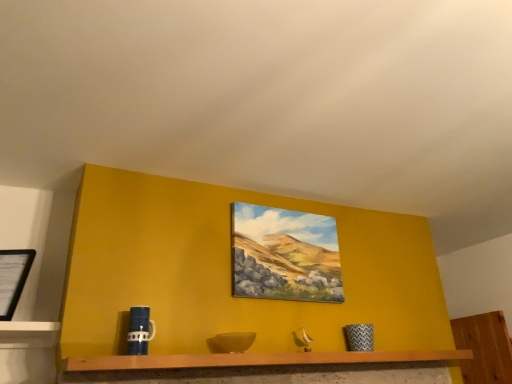
The height and width of the screenshot is (384, 512). What are the coordinates of `wooden shelf at center` in the screenshot? It's located at (257, 360).

The image size is (512, 384). In order to click on blue matte mug at lower left in this screenshot , I will do click(140, 330).

Considering the relative positions of blue matte mug at lower left and wooden shelf at center in the image provided, is blue matte mug at lower left to the right of wooden shelf at center from the viewer's perspective?

In fact, blue matte mug at lower left is to the left of wooden shelf at center.

How distant is blue matte mug at lower left from wooden shelf at center?

A distance of 16.38 inches exists between blue matte mug at lower left and wooden shelf at center.

In terms of width, does blue matte mug at lower left look wider or thinner when compared to wooden shelf at center?

In the image, blue matte mug at lower left appears to be more narrow than wooden shelf at center.

Consider the image. Is black matte picture frame at left, the second picture frame viewed from the back, surrounding blue matte mug at lower left?

No, blue matte mug at lower left is not inside black matte picture frame at left, the second picture frame viewed from the back.

Which object is closer to the camera, black matte picture frame at left, acting as the second picture frame starting from the right, or blue matte mug at lower left?

blue matte mug at lower left is closer to the camera.

Is black matte picture frame at left, the 1th picture frame viewed from the left, touching blue matte mug at lower left?

No, black matte picture frame at left, the 1th picture frame viewed from the left, is not making contact with blue matte mug at lower left.

Which object is positioned more to the right, black matte picture frame at left, the 1th picture frame viewed from the left, or blue matte mug at lower left?

Positioned to the right is blue matte mug at lower left.

Looking at this image, is the position of wooden shelf at center less distant than that of matte canvas painting at center, which ranks as the 1th picture frame in right-to-left order?

Yes, it is.

Which point is more forward, (141, 358) or (324, 288)?

Positioned in front is point (141, 358).

Does wooden shelf at center have a greater width compared to matte canvas painting at center, which is the 2th picture frame from left to right?

Correct, the width of wooden shelf at center exceeds that of matte canvas painting at center, which is the 2th picture frame from left to right.

Is matte canvas painting at center, which is the 2th picture frame from left to right, not within wooden shelf at center?

Yes, matte canvas painting at center, which is the 2th picture frame from left to right, is located beyond the bounds of wooden shelf at center.

At what (x,y) coordinates should I click in order to perform the action: click on picture frame that is the 2nd one above the wooden shelf at center (from a real-world perspective). Please return your answer as a coordinate pair (x, y). The height and width of the screenshot is (384, 512). Looking at the image, I should click on (285, 255).

Does matte canvas painting at center, which ranks as the 1th picture frame in right-to-left order, turn towards wooden shelf at center?

No.

Considering their positions, is matte canvas painting at center, arranged as the first picture frame when viewed from the back, located in front of or behind wooden shelf at center?

Clearly, matte canvas painting at center, arranged as the first picture frame when viewed from the back, is behind wooden shelf at center.

Which is in front, point (32, 262) or point (268, 279)?

The point (32, 262) is closer to the camera.

From the image's perspective, between black matte picture frame at left, the second picture frame viewed from the back, and matte canvas painting at center, arranged as the first picture frame when viewed from the back, which one is located above?

matte canvas painting at center, arranged as the first picture frame when viewed from the back, appears higher in the image.

Considering the sizes of objects black matte picture frame at left, the second picture frame viewed from the back, and matte canvas painting at center, which is the 2th picture frame from left to right, in the image provided, who is bigger, black matte picture frame at left, the second picture frame viewed from the back, or matte canvas painting at center, which is the 2th picture frame from left to right,?

matte canvas painting at center, which is the 2th picture frame from left to right, is bigger.

Is black matte picture frame at left, the 1th picture frame viewed from the left, next to matte canvas painting at center, the second picture frame in the front-to-back sequence, and touching it?

There is a gap between black matte picture frame at left, the 1th picture frame viewed from the left, and matte canvas painting at center, the second picture frame in the front-to-back sequence.

Considering the sizes of black matte picture frame at left, the 1th picture frame viewed from the left, and wooden shelf at center in the image, is black matte picture frame at left, the 1th picture frame viewed from the left, bigger or smaller than wooden shelf at center?

Clearly, black matte picture frame at left, the 1th picture frame viewed from the left, is smaller in size than wooden shelf at center.

Who is shorter, black matte picture frame at left, the second picture frame viewed from the back, or wooden shelf at center?

wooden shelf at center is shorter.

From a real-world perspective, is black matte picture frame at left, the first picture frame positioned from the front, above or below wooden shelf at center?

black matte picture frame at left, the first picture frame positioned from the front, is above wooden shelf at center.

Does black matte picture frame at left, the 1th picture frame viewed from the left, have a greater width compared to wooden shelf at center?

No, black matte picture frame at left, the 1th picture frame viewed from the left, is not wider than wooden shelf at center.

Would you say wooden shelf at center is a long distance from black matte picture frame at left, the 1th picture frame viewed from the left?

Actually, wooden shelf at center and black matte picture frame at left, the 1th picture frame viewed from the left, are a little close together.

Does wooden shelf at center appear on the left side of black matte picture frame at left, the first picture frame positioned from the front?

In fact, wooden shelf at center is to the right of black matte picture frame at left, the first picture frame positioned from the front.

Which of these two, wooden shelf at center or black matte picture frame at left, the second picture frame viewed from the back, is bigger?

Bigger between the two is wooden shelf at center.

You are a GUI agent. You are given a task and a screenshot of the screen. Output one action in this format:
    pyautogui.click(x=<x>, y=<y>)
    Task: Click on the shelf located on the right of blue matte mug at lower left
    The image size is (512, 384).
    Given the screenshot: What is the action you would take?
    pyautogui.click(x=257, y=360)

This screenshot has height=384, width=512. Find the location of `picture frame that is the 1st object above the blue matte mug at lower left (from a real-world perspective)`. picture frame that is the 1st object above the blue matte mug at lower left (from a real-world perspective) is located at coordinates (13, 278).

Based on the photo, based on their spatial positions, is black matte picture frame at left, the 1th picture frame viewed from the left, or wooden shelf at center further from matte canvas painting at center, the second picture frame in the front-to-back sequence?

black matte picture frame at left, the 1th picture frame viewed from the left, lies further to matte canvas painting at center, the second picture frame in the front-to-back sequence, than the other object.

From the image, which object appears to be nearer to blue matte mug at lower left, black matte picture frame at left, the first picture frame positioned from the front, or matte canvas painting at center, which ranks as the 1th picture frame in right-to-left order?

Based on the image, black matte picture frame at left, the first picture frame positioned from the front, appears to be nearer to blue matte mug at lower left.

Considering their positions, is black matte picture frame at left, the first picture frame positioned from the front, positioned further to matte canvas painting at center, the second picture frame in the front-to-back sequence, than blue matte mug at lower left?

black matte picture frame at left, the first picture frame positioned from the front, is positioned further to the anchor matte canvas painting at center, the second picture frame in the front-to-back sequence.

From the image, which object appears to be nearer to blue matte mug at lower left, matte canvas painting at center, which is the 2th picture frame from left to right, or black matte picture frame at left, the 1th picture frame viewed from the left?

Among the two, black matte picture frame at left, the 1th picture frame viewed from the left, is located nearer to blue matte mug at lower left.

Looking at the image, which one is located further to matte canvas painting at center, which is the 2th picture frame from left to right, blue matte mug at lower left or wooden shelf at center?

Among the two, blue matte mug at lower left is located further to matte canvas painting at center, which is the 2th picture frame from left to right.

Considering their positions, is black matte picture frame at left, the second picture frame viewed from the back, positioned closer to blue matte mug at lower left than wooden shelf at center?

wooden shelf at center lies closer to blue matte mug at lower left than the other object.

Considering their positions, is black matte picture frame at left, acting as the second picture frame starting from the right, positioned further to wooden shelf at center than blue matte mug at lower left?

black matte picture frame at left, acting as the second picture frame starting from the right.

When comparing their distances from black matte picture frame at left, the second picture frame viewed from the back, does matte canvas painting at center, arranged as the first picture frame when viewed from the back, or blue matte mug at lower left seem closer?

Based on the image, blue matte mug at lower left appears to be nearer to black matte picture frame at left, the second picture frame viewed from the back.

The width and height of the screenshot is (512, 384). I want to click on mug situated between black matte picture frame at left, the first picture frame positioned from the front, and wooden shelf at center from left to right, so click(140, 330).

I want to click on picture frame situated between black matte picture frame at left, the 1th picture frame viewed from the left, and wooden shelf at center from left to right, so click(285, 255).

I want to click on picture frame between blue matte mug at lower left and wooden shelf at center, so click(285, 255).

At what (x,y) coordinates should I click in order to perform the action: click on mug between black matte picture frame at left, the 1th picture frame viewed from the left, and matte canvas painting at center, the second picture frame in the front-to-back sequence, from left to right. Please return your answer as a coordinate pair (x, y). Image resolution: width=512 pixels, height=384 pixels. Looking at the image, I should click on (140, 330).